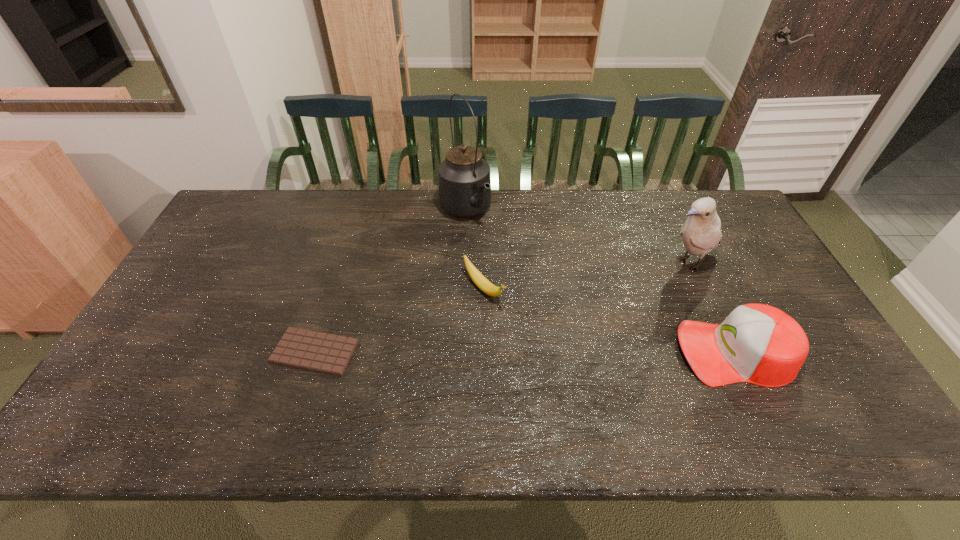
Locate an element on the screen. This screenshot has width=960, height=540. the shortest object is located at coordinates (310, 350).

Where is `chocolate bar`? chocolate bar is located at coordinates (310, 350).

The image size is (960, 540). I want to click on baseball cap, so click(x=759, y=344).

Where is `the fourth tallest object`? This screenshot has height=540, width=960. the fourth tallest object is located at coordinates point(482,283).

Where is `bird`? This screenshot has height=540, width=960. bird is located at coordinates (701, 232).

Locate an element on the screen. The height and width of the screenshot is (540, 960). kettle is located at coordinates (464, 184).

The image size is (960, 540). Find the location of `the farthest object`. the farthest object is located at coordinates (464, 184).

Where is `vacant space situated on the left of the shortest object`? This screenshot has height=540, width=960. vacant space situated on the left of the shortest object is located at coordinates (210, 352).

Locate an element on the screen. blank area located on the front-facing side of the third shortest object is located at coordinates (546, 352).

This screenshot has width=960, height=540. I want to click on vacant position located 0.360m on the front-facing side of the third shortest object, so click(539, 352).